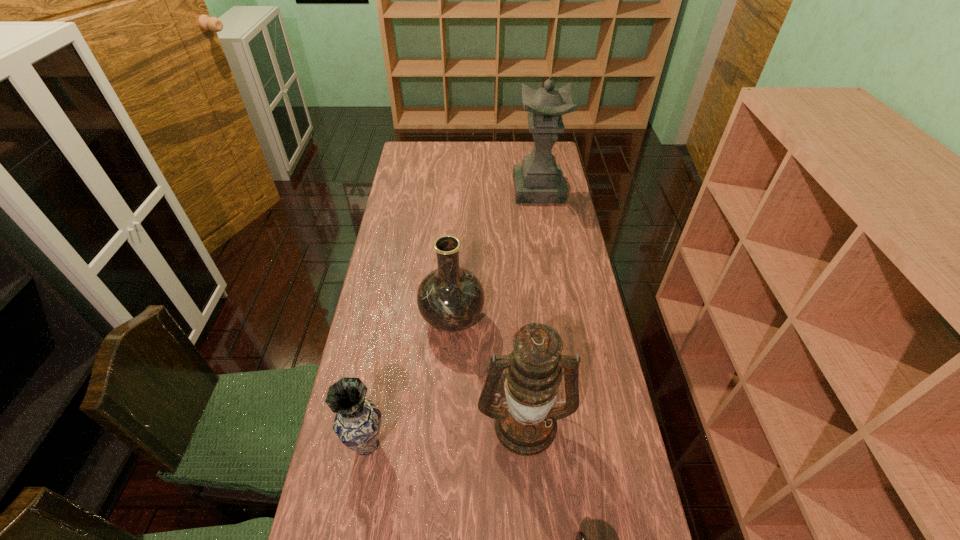
This screenshot has width=960, height=540. Find the location of `sculpture`. sculpture is located at coordinates (x=538, y=179).

Where is `the tallest object`? The height and width of the screenshot is (540, 960). the tallest object is located at coordinates (538, 179).

Where is `lantern`? lantern is located at coordinates click(x=525, y=423).

Image resolution: width=960 pixels, height=540 pixels. I want to click on the taller vase, so pyautogui.click(x=450, y=298).

Find the location of a particular element. This screenshot has width=960, height=540. the right vase is located at coordinates (450, 298).

The width and height of the screenshot is (960, 540). What are the coordinates of `the left vase` in the screenshot? It's located at (357, 423).

Identify the location of the shorter vase. This screenshot has width=960, height=540. (357, 423).

The width and height of the screenshot is (960, 540). I want to click on vacant space located at the front opening of the farthest object, so pos(548,250).

Where is `free space located 0.100m on the right of the lantern`? This screenshot has width=960, height=540. free space located 0.100m on the right of the lantern is located at coordinates (609, 422).

Locate an element on the screen. This screenshot has height=540, width=960. vacant region located on the left of the farther vase is located at coordinates (377, 319).